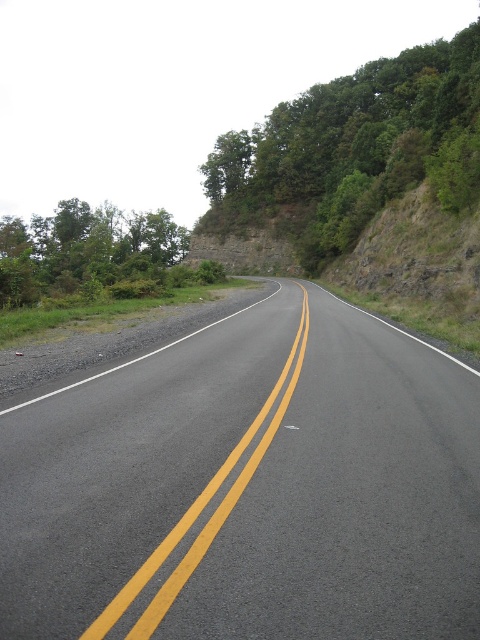
Between green leafy tree at upper center and yellow asphalt road at center, which one appears on the left side from the viewer's perspective?

yellow asphalt road at center

Identify the location of green leafy tree at upper center. The image size is (480, 640). (352, 148).

The width and height of the screenshot is (480, 640). What are the coordinates of `green leafy tree at upper center` in the screenshot? It's located at pos(352,148).

Does green leafy tree at upper center appear on the left side of green leafy trees at upper left?

In fact, green leafy tree at upper center is to the right of green leafy trees at upper left.

Based on the photo, who is positioned more to the right, green leafy tree at upper center or green leafy trees at upper left?

green leafy tree at upper center

Image resolution: width=480 pixels, height=640 pixels. Describe the element at coordinates (352, 148) in the screenshot. I see `green leafy tree at upper center` at that location.

Find the location of `green leafy tree at upper center`. green leafy tree at upper center is located at coordinates (352, 148).

Is asphalt road at center smaller than green leafy tree at upper center?

Yes.

Which is below, asphalt road at center or green leafy tree at upper center?

asphalt road at center

Which is in front, point (218, 579) or point (344, 115)?

Positioned in front is point (218, 579).

I want to click on asphalt road at center, so click(x=248, y=486).